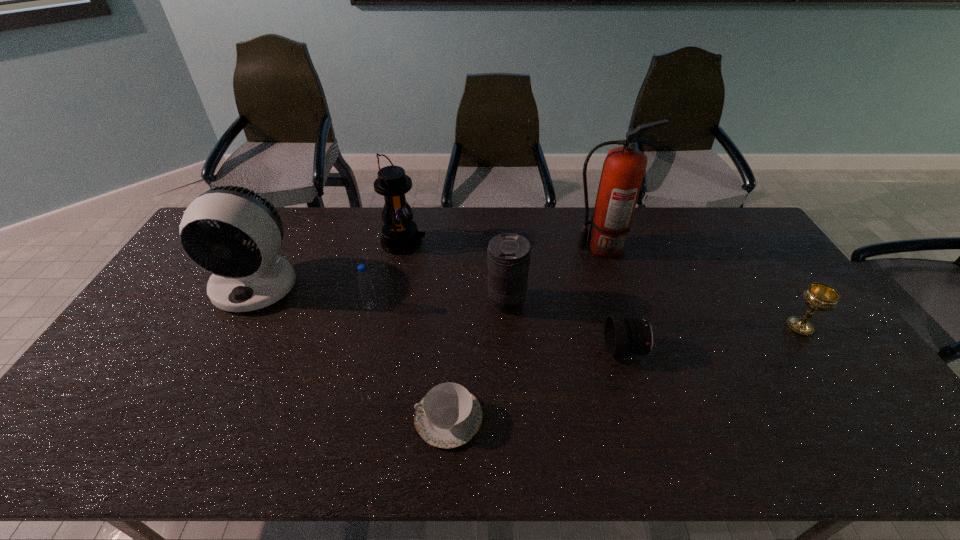
Identify the location of the shortest object. click(448, 416).

Identify the location of vacant space situated on the nozzle of the tallest object. The width and height of the screenshot is (960, 540). (520, 247).

The height and width of the screenshot is (540, 960). I want to click on vacant region located 0.090m on the nozzle of the tallest object, so click(543, 247).

Locate an element on the screen. The width and height of the screenshot is (960, 540). vacant position located on the nozzle of the tallest object is located at coordinates (549, 247).

Locate the blank area located above the lantern, indicating its light source in the image. Please provide its 2D coordinates. Your answer should be formatted as a tuple, i.e. [(x, y)], where the tuple contains the x and y coordinates of a point satisfying the conditions above.

[(493, 242)]

You are a GUI agent. You are given a task and a screenshot of the screen. Output one action in this format:
    pyautogui.click(x=<x>, y=<y>)
    Task: Click on the free point located 0.350m on the grille of the fan
    
    Given the screenshot: What is the action you would take?
    pyautogui.click(x=182, y=426)

The height and width of the screenshot is (540, 960). What are the coordinates of `vacant area situated on the side of the farther telephoto lens where the control switches are located` in the screenshot? It's located at (382, 302).

The height and width of the screenshot is (540, 960). What are the coordinates of `blank space located on the side of the farther telephoto lens where the control switches are located` in the screenshot? It's located at (427, 302).

Identify the location of free space located on the side of the farther telephoto lens where the control switches are located. The width and height of the screenshot is (960, 540). (366, 302).

I want to click on free space located on the left of the water bottle, so click(344, 306).